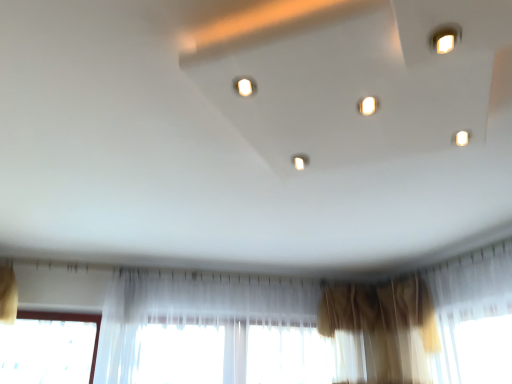
This screenshot has height=384, width=512. Find the location of `matte white light at center, which is the first light in front-to-back order`. matte white light at center, which is the first light in front-to-back order is located at coordinates (245, 86).

In order to face matte white light at center, which appears as the 1th light when viewed from the left, should I rotate leftwards or rightwards?

To align with it, rotate left about 1.313°.

How much space does brown sheer curtain at lower right, which is the 2th curtain from left to right, occupy horizontally?

brown sheer curtain at lower right, which is the 2th curtain from left to right, is 17.06 centimeters in width.

In order to face brown sheer curtain at lower right, which is the 2th curtain from left to right, should I rotate leftwards or rightwards?

A 19.425 degree turn to the right will do.

You are a GUI agent. You are given a task and a screenshot of the screen. Output one action in this format:
    pyautogui.click(x=<x>, y=<y>)
    Task: Click on the translucent fabric curtain at lower center, which ranks as the 2th curtain in right-to-left order
    The width and height of the screenshot is (512, 384).
    Given the screenshot: What is the action you would take?
    pyautogui.click(x=218, y=332)

Locate an element on the screen. the 1st curtain behind the matte white light at center, which appears as the 1th light when viewed from the left, counting from the anchor's position is located at coordinates (383, 326).

In terms of width, does brown sheer curtain at lower right, the first curtain in the right-to-left sequence, look wider or thinner when compared to matte white light at center, which appears as the 1th light when viewed from the left?

Considering their sizes, brown sheer curtain at lower right, the first curtain in the right-to-left sequence, looks broader than matte white light at center, which appears as the 1th light when viewed from the left.

In the scene shown: Could you tell me if brown sheer curtain at lower right, which is the 2th curtain from left to right, is turned towards matte white light at center, the second light from the bottom?

No, brown sheer curtain at lower right, which is the 2th curtain from left to right, is not facing towards matte white light at center, the second light from the bottom.

Is matte white light at center, positioned as the 1th light in top-to-bottom order, to the left of white glossy light at center, the first light from the back, from the viewer's perspective?

Correct, you'll find matte white light at center, positioned as the 1th light in top-to-bottom order, to the left of white glossy light at center, the first light from the back.

Looking at this image, in terms of height, does matte white light at center, which appears as the second light when viewed from the right, look taller or shorter compared to white glossy light at center, which ranks as the 1th light in right-to-left order?

In the image, matte white light at center, which appears as the second light when viewed from the right, appears to be taller than white glossy light at center, which ranks as the 1th light in right-to-left order.

Consider the image. Is the depth of matte white light at center, which is the first light in front-to-back order, greater than that of white glossy light at center, arranged as the second light when viewed from the top?

No, it is in front of white glossy light at center, arranged as the second light when viewed from the top.

Locate an element on the screen. The height and width of the screenshot is (384, 512). light in front of the white glossy light at center, placed as the 1th light when sorted from bottom to top is located at coordinates (245, 86).

From the image's perspective, does white glossy light at center, placed as the 1th light when sorted from bottom to top, appear lower than brown sheer curtain at lower right, the first curtain in the right-to-left sequence?

Incorrect, from the image's perspective, white glossy light at center, placed as the 1th light when sorted from bottom to top, is higher than brown sheer curtain at lower right, the first curtain in the right-to-left sequence.

Can you confirm if white glossy light at center, which is the 2th light in left-to-right order, is thinner than brown sheer curtain at lower right, the first curtain in the right-to-left sequence?

Yes.

Considering the sizes of objects white glossy light at center, the first light from the back, and brown sheer curtain at lower right, the first curtain in the right-to-left sequence, in the image provided, who is bigger, white glossy light at center, the first light from the back, or brown sheer curtain at lower right, the first curtain in the right-to-left sequence,?

brown sheer curtain at lower right, the first curtain in the right-to-left sequence, is bigger.

How different are the orientations of white glossy light at center, placed as the 1th light when sorted from bottom to top, and brown sheer curtain at lower right, the first curtain in the right-to-left sequence, in degrees?

The angular difference between white glossy light at center, placed as the 1th light when sorted from bottom to top, and brown sheer curtain at lower right, the first curtain in the right-to-left sequence, is 123 degrees.

From the image's perspective, is translucent fabric curtain at lower center, placed as the 1th curtain when sorted from left to right, on top of matte white light at center, which is the first light in front-to-back order?

No, from the image's perspective, translucent fabric curtain at lower center, placed as the 1th curtain when sorted from left to right, is not over matte white light at center, which is the first light in front-to-back order.

Relative to matte white light at center, which appears as the second light when viewed from the right, is translucent fabric curtain at lower center, placed as the 1th curtain when sorted from left to right, in front or behind?

translucent fabric curtain at lower center, placed as the 1th curtain when sorted from left to right, is behind matte white light at center, which appears as the second light when viewed from the right.

Is translucent fabric curtain at lower center, which ranks as the 2th curtain in right-to-left order, positioned with its back to matte white light at center, which is the first light in front-to-back order?

translucent fabric curtain at lower center, which ranks as the 2th curtain in right-to-left order, is not turned away from matte white light at center, which is the first light in front-to-back order.

Are translucent fabric curtain at lower center, placed as the 1th curtain when sorted from left to right, and matte white light at center, positioned as the 1th light in top-to-bottom order, making contact?

No, translucent fabric curtain at lower center, placed as the 1th curtain when sorted from left to right, is not next to matte white light at center, positioned as the 1th light in top-to-bottom order.

Image resolution: width=512 pixels, height=384 pixels. I want to click on curtain behind the brown sheer curtain at lower right, the first curtain in the right-to-left sequence, so click(218, 332).

From the image's perspective, would you say translucent fabric curtain at lower center, placed as the 1th curtain when sorted from left to right, is positioned over brown sheer curtain at lower right, which is the 2th curtain from left to right?

Actually, translucent fabric curtain at lower center, placed as the 1th curtain when sorted from left to right, appears below brown sheer curtain at lower right, which is the 2th curtain from left to right, in the image.

Which object is positioned more to the left, translucent fabric curtain at lower center, which ranks as the 2th curtain in right-to-left order, or brown sheer curtain at lower right, which is the 2th curtain from left to right?

From the viewer's perspective, translucent fabric curtain at lower center, which ranks as the 2th curtain in right-to-left order, appears more on the left side.

In terms of width, does translucent fabric curtain at lower center, which ranks as the 2th curtain in right-to-left order, look wider or thinner when compared to brown sheer curtain at lower right, which is the 2th curtain from left to right?

Clearly, translucent fabric curtain at lower center, which ranks as the 2th curtain in right-to-left order, has more width compared to brown sheer curtain at lower right, which is the 2th curtain from left to right.

Who is smaller, white glossy light at center, which ranks as the 1th light in right-to-left order, or translucent fabric curtain at lower center, which ranks as the 2th curtain in right-to-left order?

With smaller size is white glossy light at center, which ranks as the 1th light in right-to-left order.

Which is correct: white glossy light at center, which is the 2th light in left-to-right order, is inside translucent fabric curtain at lower center, which ranks as the 2th curtain in right-to-left order, or outside of it?

white glossy light at center, which is the 2th light in left-to-right order, exists outside the volume of translucent fabric curtain at lower center, which ranks as the 2th curtain in right-to-left order.

Is white glossy light at center, arranged as the second light when viewed from the top, far from translucent fabric curtain at lower center, which ranks as the 2th curtain in right-to-left order?

That's right, there is a large distance between white glossy light at center, arranged as the second light when viewed from the top, and translucent fabric curtain at lower center, which ranks as the 2th curtain in right-to-left order.

Based on the photo, from the image's perspective, does white glossy light at center, the first light from the back, appear higher than translucent fabric curtain at lower center, placed as the 1th curtain when sorted from left to right?

Yes.

Is white glossy light at center, arranged as the second light when viewed from the top, inside or outside of matte white light at center, the second light when ordered from back to front?

white glossy light at center, arranged as the second light when viewed from the top, is not inside matte white light at center, the second light when ordered from back to front, it's outside.

Is point (303, 160) closer or farther from the camera than point (250, 78)?

Clearly, point (303, 160) is more distant from the camera than point (250, 78).

In the image, is white glossy light at center, which is the 2th light in left-to-right order, positioned in front of or behind matte white light at center, the second light from the bottom?

Visually, white glossy light at center, which is the 2th light in left-to-right order, is located behind matte white light at center, the second light from the bottom.

From a real-world perspective, count 1st curtains downward from the matte white light at center, positioned as the 1th light in top-to-bottom order, and point to it. Please provide its 2D coordinates.

[(383, 326)]

The image size is (512, 384). Find the location of `light lying behind the matte white light at center, positioned as the 1th light in top-to-bottom order`. light lying behind the matte white light at center, positioned as the 1th light in top-to-bottom order is located at coordinates (300, 161).

Looking at this image, when comparing their distances from matte white light at center, the second light from the bottom, does white glossy light at center, placed as the 1th light when sorted from bottom to top, or brown sheer curtain at lower right, the first curtain in the right-to-left sequence, seem closer?

white glossy light at center, placed as the 1th light when sorted from bottom to top.

Estimate the real-world distances between objects in this image. Which object is further from translucent fabric curtain at lower center, which ranks as the 2th curtain in right-to-left order, brown sheer curtain at lower right, which is the 2th curtain from left to right, or white glossy light at center, the first light from the back?

The object further to translucent fabric curtain at lower center, which ranks as the 2th curtain in right-to-left order, is white glossy light at center, the first light from the back.

Considering their positions, is white glossy light at center, arranged as the second light when viewed from the top, positioned closer to matte white light at center, the second light when ordered from back to front, than translucent fabric curtain at lower center, placed as the 1th curtain when sorted from left to right?

Based on the image, white glossy light at center, arranged as the second light when viewed from the top, appears to be nearer to matte white light at center, the second light when ordered from back to front.

Which object lies nearer to the anchor point white glossy light at center, placed as the 1th light when sorted from bottom to top, brown sheer curtain at lower right, the first curtain in the right-to-left sequence, or matte white light at center, the second light when ordered from back to front?

matte white light at center, the second light when ordered from back to front, is closer to white glossy light at center, placed as the 1th light when sorted from bottom to top.

When comparing their distances from brown sheer curtain at lower right, which is the 2th curtain from left to right, does matte white light at center, which appears as the 1th light when viewed from the left, or translucent fabric curtain at lower center, placed as the 1th curtain when sorted from left to right, seem closer?

Among the two, translucent fabric curtain at lower center, placed as the 1th curtain when sorted from left to right, is located nearer to brown sheer curtain at lower right, which is the 2th curtain from left to right.

Based on their spatial positions, is matte white light at center, which appears as the 1th light when viewed from the left, or white glossy light at center, placed as the 1th light when sorted from bottom to top, closer to translucent fabric curtain at lower center, placed as the 1th curtain when sorted from left to right?

Based on the image, white glossy light at center, placed as the 1th light when sorted from bottom to top, appears to be nearer to translucent fabric curtain at lower center, placed as the 1th curtain when sorted from left to right.

Based on their spatial positions, is translucent fabric curtain at lower center, which ranks as the 2th curtain in right-to-left order, or matte white light at center, the second light when ordered from back to front, further from brown sheer curtain at lower right, which is the 2th curtain from left to right?

matte white light at center, the second light when ordered from back to front, is positioned further to the anchor brown sheer curtain at lower right, which is the 2th curtain from left to right.

In the scene shown: When comparing their distances from translucent fabric curtain at lower center, placed as the 1th curtain when sorted from left to right, does brown sheer curtain at lower right, which is the 2th curtain from left to right, or matte white light at center, which is the first light in front-to-back order, seem closer?

Among the two, brown sheer curtain at lower right, which is the 2th curtain from left to right, is located nearer to translucent fabric curtain at lower center, placed as the 1th curtain when sorted from left to right.

In order to click on curtain between matte white light at center, which is the first light in front-to-back order, and translucent fabric curtain at lower center, which ranks as the 2th curtain in right-to-left order, along the z-axis in this screenshot , I will do `click(383, 326)`.

Identify the location of light between matte white light at center, which is the first light in front-to-back order, and translucent fabric curtain at lower center, which ranks as the 2th curtain in right-to-left order, in the front-back direction. The image size is (512, 384). (300, 161).

Where is `curtain between white glossy light at center, arranged as the second light when viewed from the top, and translucent fabric curtain at lower center, placed as the 1th curtain when sorted from left to right, from front to back`? curtain between white glossy light at center, arranged as the second light when viewed from the top, and translucent fabric curtain at lower center, placed as the 1th curtain when sorted from left to right, from front to back is located at coordinates (383, 326).

The width and height of the screenshot is (512, 384). Identify the location of light between matte white light at center, which is the first light in front-to-back order, and brown sheer curtain at lower right, which is the 2th curtain from left to right, along the z-axis. (300, 161).